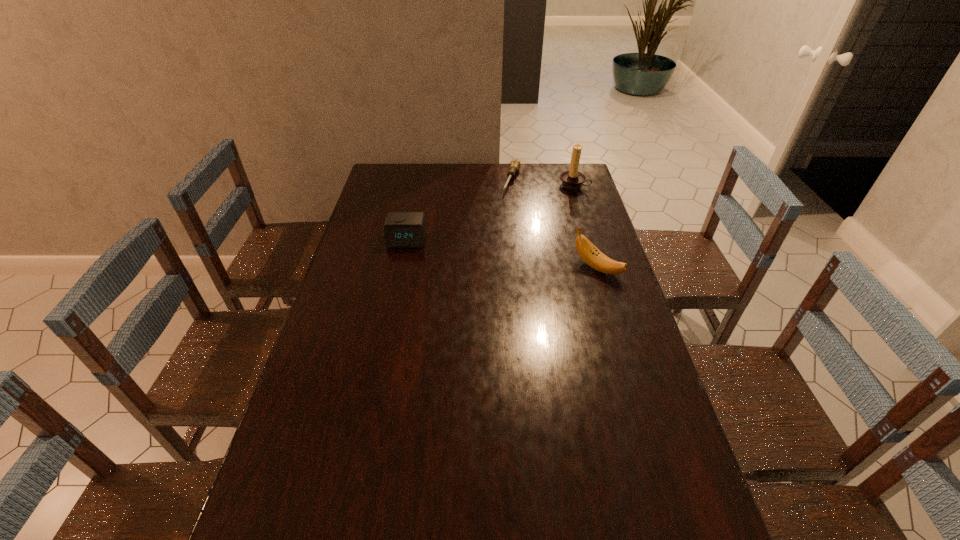
Locate an element on the screen. This screenshot has height=540, width=960. vacant space on the desktop that is between the leftmost object and the nearest object and is positioned at the tip of the third object from right to left is located at coordinates (479, 250).

Identify the location of vacant space on the desktop that is between the alarm clock and the banana and is positioned on the wick of the tallest object. The width and height of the screenshot is (960, 540). (491, 252).